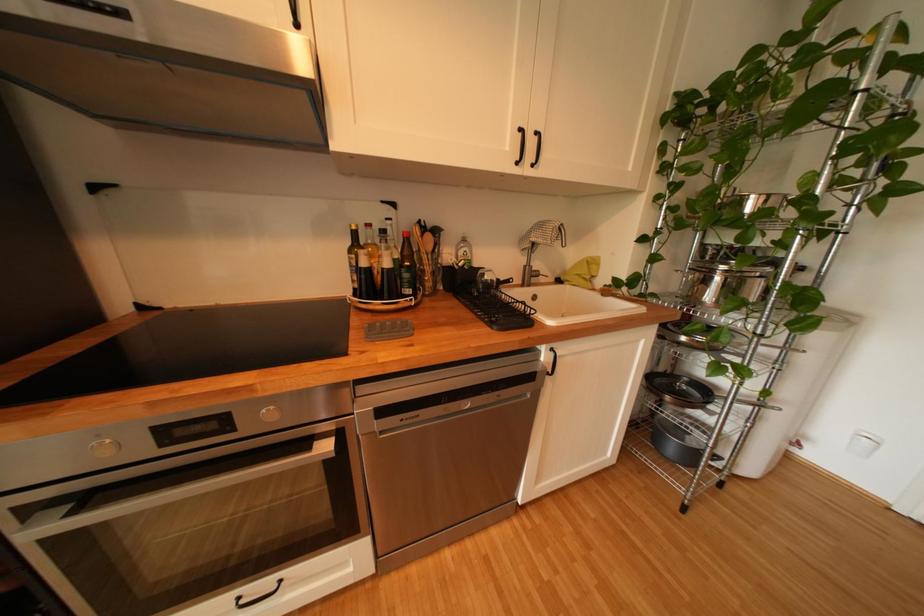
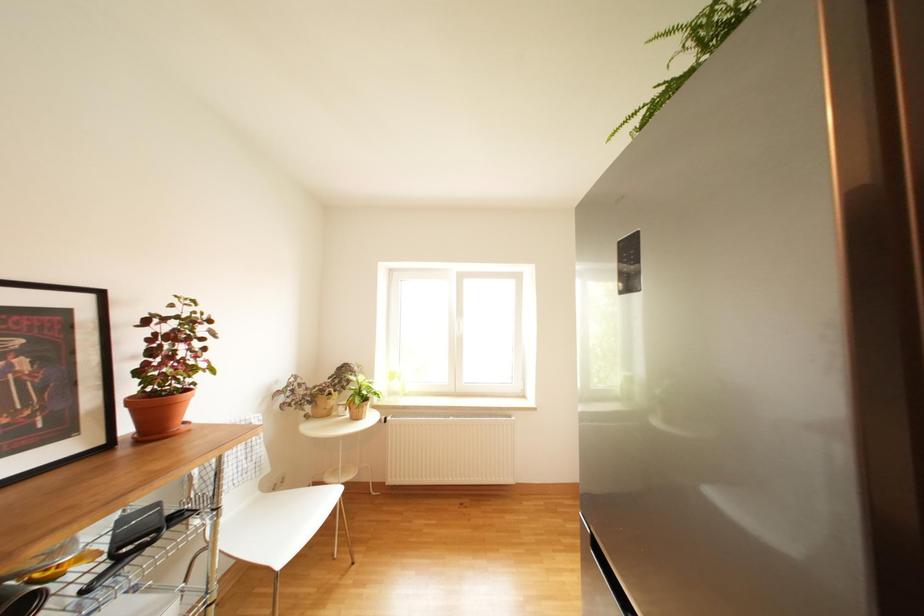
Question: Based on the continuous images, in which direction is the camera rotating? Reply with the corresponding letter.

Choices:
 (A) Left
 (B) Right
 (C) Up
 (D) Down

Answer: (A)